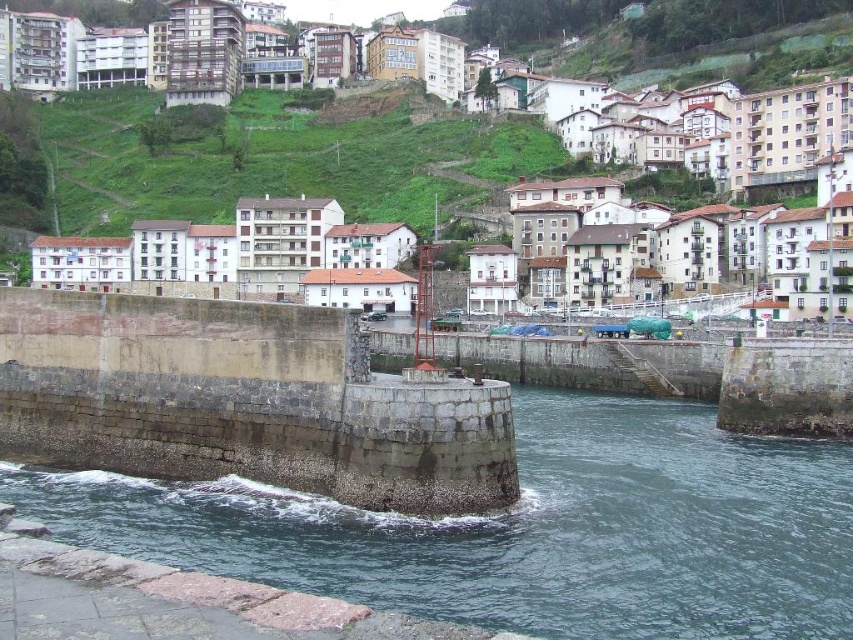
Question: In this image, where is dark gray stone river at center located relative to white stone buildings at center?

Choices:
 (A) below
 (B) above

Answer: (A)

Question: Which point is closer to the camera taking this photo?

Choices:
 (A) (123, 160)
 (B) (601, 410)

Answer: (B)

Question: Estimate the real-world distances between objects in this image. Which object is closer to the dark gray stone river at center?

Choices:
 (A) green grassy hillside at upper center
 (B) white stone buildings at center

Answer: (A)

Question: Is white stone buildings at center in front of green grassy hillside at upper center?

Choices:
 (A) yes
 (B) no

Answer: (A)

Question: Is white stone buildings at center wider than green grassy hillside at upper center?

Choices:
 (A) yes
 (B) no

Answer: (A)

Question: Which of these objects is positioned farthest from the green grassy hillside at upper center?

Choices:
 (A) white stone buildings at center
 (B) dark gray stone river at center

Answer: (B)